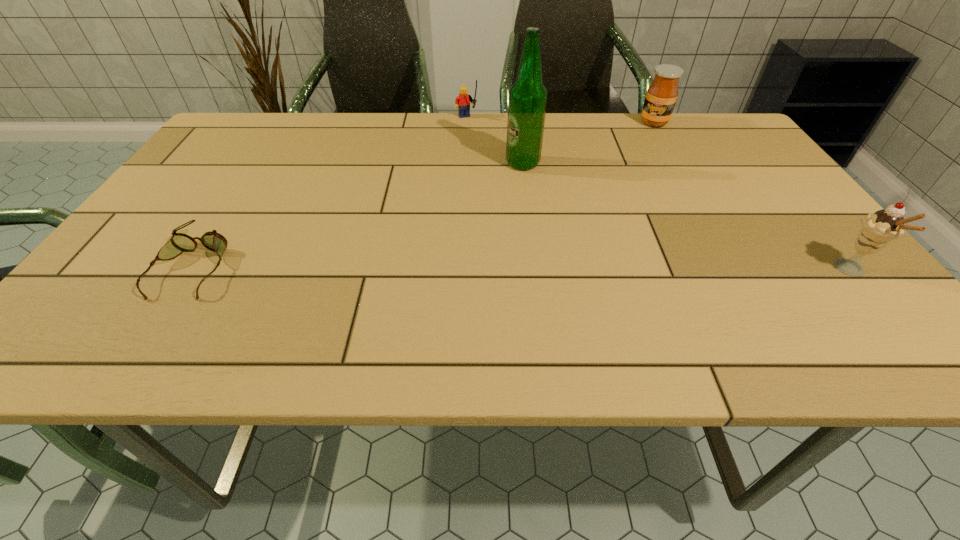
At what (x,y) coordinates should I click in order to perform the action: click on Lego located at the far edge. Please return your answer as a coordinate pair (x, y). Looking at the image, I should click on (462, 102).

This screenshot has width=960, height=540. In order to click on honey that is positioned at the far edge in this screenshot , I will do `click(661, 97)`.

You are a GUI agent. You are given a task and a screenshot of the screen. Output one action in this format:
    pyautogui.click(x=<x>, y=<y>)
    Task: Click on the spectacles located in the near edge section of the desktop
    The height and width of the screenshot is (540, 960).
    Given the screenshot: What is the action you would take?
    pyautogui.click(x=179, y=242)

Where is `icecream that is at the near edge`? Image resolution: width=960 pixels, height=540 pixels. icecream that is at the near edge is located at coordinates (879, 228).

Where is `object that is at the left edge`? This screenshot has width=960, height=540. object that is at the left edge is located at coordinates (179, 242).

You are a GUI agent. You are given a task and a screenshot of the screen. Output one action in this format:
    pyautogui.click(x=<x>, y=<y>)
    Task: Click on the object that is at the right edge
    The height and width of the screenshot is (540, 960).
    Given the screenshot: What is the action you would take?
    pyautogui.click(x=879, y=228)

Identify the location of object that is at the near left corner. (179, 242).

Where is `object present at the near right corner`? The height and width of the screenshot is (540, 960). object present at the near right corner is located at coordinates (879, 228).

The height and width of the screenshot is (540, 960). I want to click on blank space at the far edge, so click(x=470, y=154).

Image resolution: width=960 pixels, height=540 pixels. In order to click on free space at the near edge of the desktop in this screenshot , I will do `click(682, 292)`.